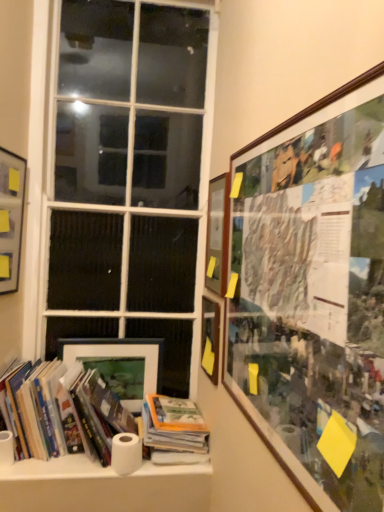
The width and height of the screenshot is (384, 512). I want to click on vacant space that's between hardcover books at lower left, the 2th book in the right-to-left sequence, and white matte toilet paper at lower center, so click(x=71, y=472).